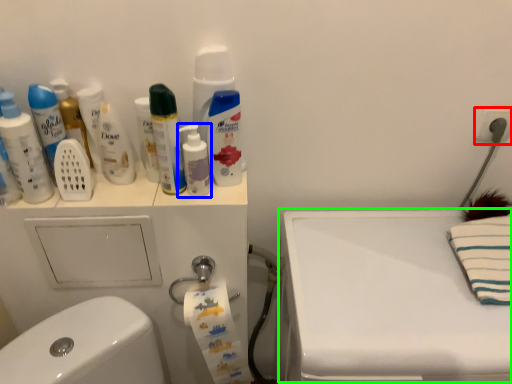
Question: Which is farther away from electric outlet (highlighted by a red box)? mouthwash (highlighted by a blue box) or counter top (highlighted by a green box)?

Choices:
 (A) mouthwash
 (B) counter top

Answer: (A)